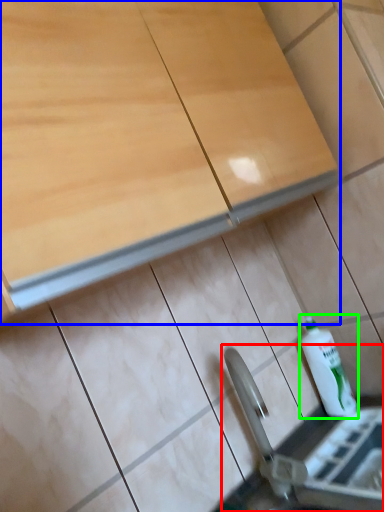
Question: Estimate the real-world distances between objects in this image. Which object is closer to sink (highlighted by a red box), cabinetry (highlighted by a blue box) or bottle (highlighted by a green box)?

Choices:
 (A) cabinetry
 (B) bottle

Answer: (B)